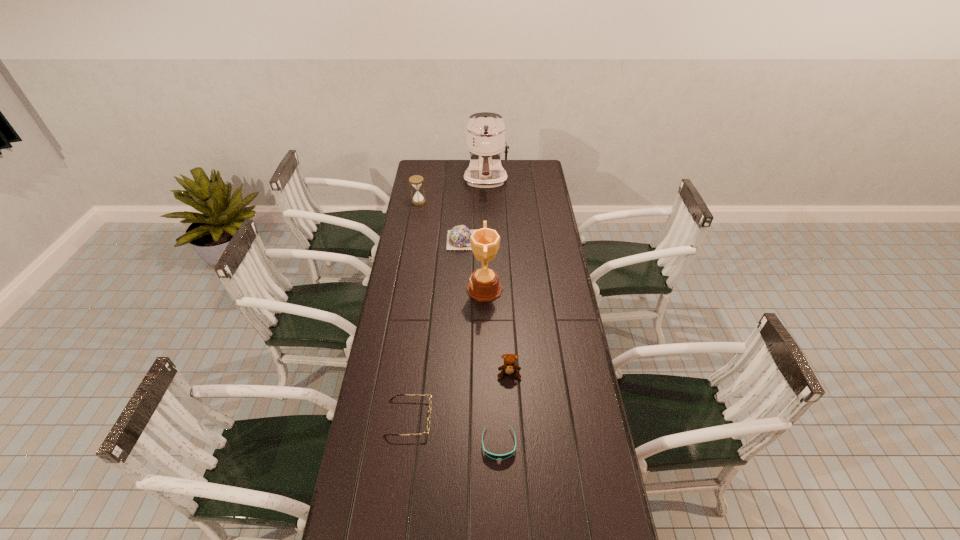
The image size is (960, 540). In order to click on coffee maker in this screenshot , I will do [x=485, y=131].

Identify the location of the fourth farthest object. The image size is (960, 540). (484, 286).

At what (x,y) coordinates should I click in order to perform the action: click on the sixth shortest object. Please return your answer as a coordinate pair (x, y). The width and height of the screenshot is (960, 540). Looking at the image, I should click on (484, 286).

Locate an element on the screen. hourglass is located at coordinates (416, 180).

Image resolution: width=960 pixels, height=540 pixels. In order to click on the third nearest object in this screenshot , I will do `click(509, 367)`.

This screenshot has width=960, height=540. Identify the location of the fourth tallest object. (509, 367).

Where is `the third farthest object`? the third farthest object is located at coordinates [x=458, y=238].

The height and width of the screenshot is (540, 960). Identify the location of cap. (458, 238).

Locate an element on the screen. The height and width of the screenshot is (540, 960). spectacles is located at coordinates (430, 404).

Where is `the shortest object`? The width and height of the screenshot is (960, 540). the shortest object is located at coordinates (494, 456).